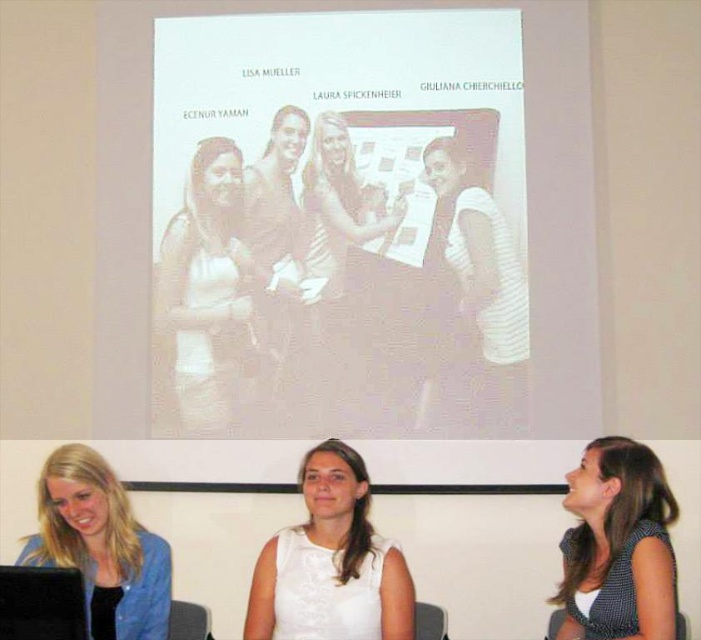
You are organizing a photo shoot and need to arrange two shirts in the scene. The white striped shirt at center and the white dotted shirt at lower right must be placed according to their positions in the original image. Which shirt should be placed higher up in the frame?

The white striped shirt at center should be placed higher up in the frame because it is positioned over the white dotted shirt at lower right in the original image.

Please look at the image. There is a point located at coordinates (329, 561). Based on the description, where exactly is this point located in the scene?

The point at (329, 561) is located on the white matte dress at center.